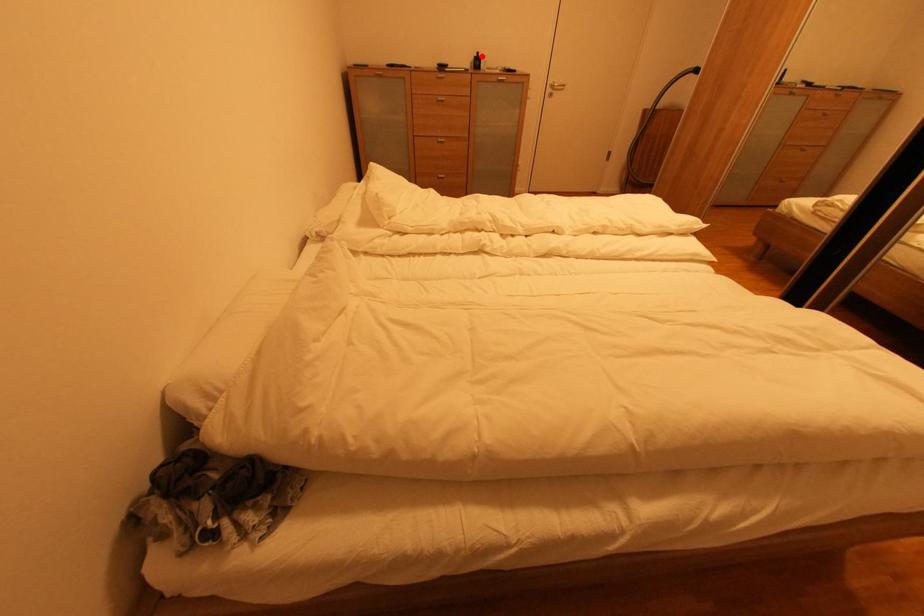
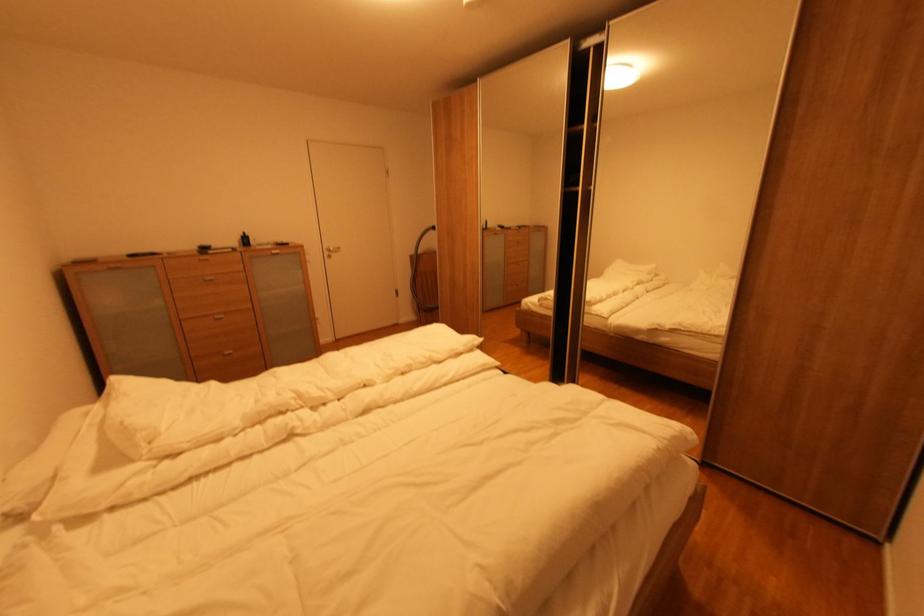
Find the pixel in the second image that matches the highlighted location in the first image.

(248, 237)